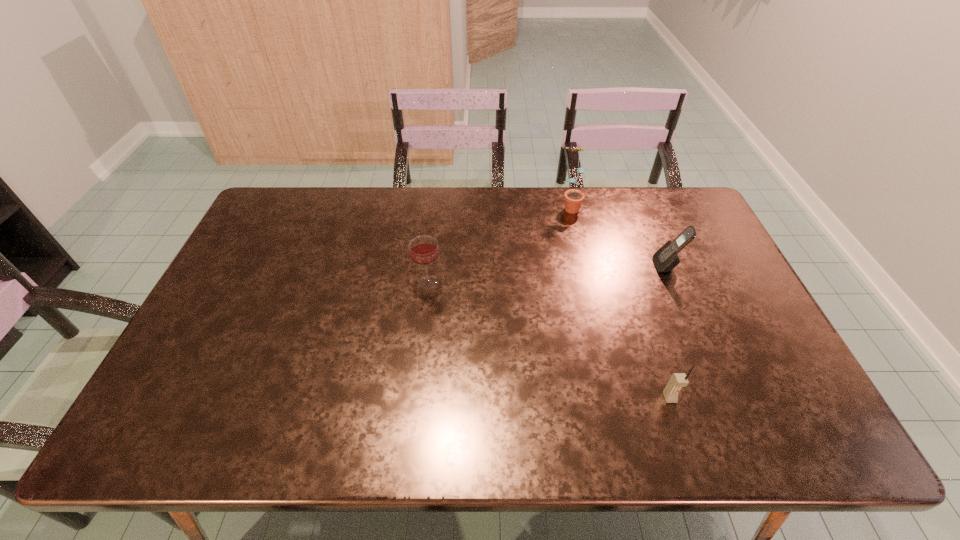
At what (x,y) coordinates should I click in order to perform the action: click on object that is the second nearest to the leftmost object. Please return your answer as a coordinate pair (x, y). Looking at the image, I should click on (678, 380).

I want to click on vacant area that satisfies the following two spatial constraints: 1. on the front-facing side of the right cellular telephone; 2. on the front of the nearest object, where the keypad is located, so click(723, 398).

The width and height of the screenshot is (960, 540). I want to click on vacant position in the image that satisfies the following two spatial constraints: 1. on the front-facing side of the rightmost object; 2. on the front side of the leftmost object, so point(674,282).

What are the coordinates of `free region that satisfies the following two spatial constraints: 1. on the front-facing side of the rightmost object; 2. on the front side of the wineglass` in the screenshot? It's located at (674, 282).